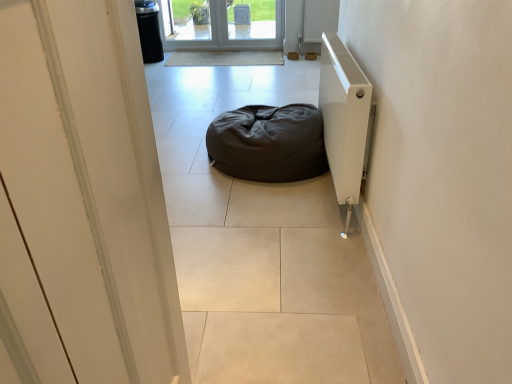
The height and width of the screenshot is (384, 512). In order to click on white textured radiator at right in this screenshot , I will do `click(344, 119)`.

Can you confirm if white glossy door at upper center is shorter than white textured radiator at right?

Incorrect, the height of white glossy door at upper center does not fall short of that of white textured radiator at right.

Is white textured radiator at right inside white glossy door at upper center?

No, white textured radiator at right is not surrounded by white glossy door at upper center.

Between white glossy door at upper center and white textured radiator at right, which one has larger width?

white glossy door at upper center is wider.

From a real-world perspective, is white glossy door at upper center beneath white textured radiator at right?

Incorrect, from a real-world perspective, white glossy door at upper center is higher than white textured radiator at right.

Is white textured radiator at right in front of white glossy door at upper center?

No, white textured radiator at right is further to the viewer.

Is white textured radiator at right wider or thinner than white glossy door at upper center?

white textured radiator at right is thinner than white glossy door at upper center.

Is white textured radiator at right not inside white glossy door at upper center?

white textured radiator at right is positioned outside white glossy door at upper center.

Considering the relative positions of white textured radiator at right and white glossy door at upper center in the image provided, is white textured radiator at right to the left of white glossy door at upper center from the viewer's perspective?

No.

Can you tell me how much white glossy door at upper center and dark fabric bean bag at center differ in facing direction?

white glossy door at upper center and dark fabric bean bag at center are facing 176 degrees away from each other.

Between white glossy door at upper center and dark fabric bean bag at center, which one has less height?

dark fabric bean bag at center.

Considering the positions of points (50, 106) and (247, 153), is point (50, 106) closer to camera compared to point (247, 153)?

Yes.

From a real-world perspective, is white glossy door at upper center above or below dark fabric bean bag at center?

From a real-world perspective, white glossy door at upper center is physically above dark fabric bean bag at center.

From a real-world perspective, is white textured radiator at right physically below dark fabric bean bag at center?

No, from a real-world perspective, white textured radiator at right is not below dark fabric bean bag at center.

Is white textured radiator at right positioned with its back to dark fabric bean bag at center?

Absolutely, white textured radiator at right is directed away from dark fabric bean bag at center.

The width and height of the screenshot is (512, 384). In the image, there is a dark fabric bean bag at center. In order to click on radiator below it (from the image's perspective) in this screenshot , I will do `click(344, 119)`.

Does white textured radiator at right come in front of dark fabric bean bag at center?

Yes, white textured radiator at right is in front of dark fabric bean bag at center.

Relative to white textured radiator at right, is dark fabric bean bag at center in front or behind?

Clearly, dark fabric bean bag at center is behind white textured radiator at right.

Based on their positions, is dark fabric bean bag at center located to the left or right of white textured radiator at right?

In the image, dark fabric bean bag at center appears on the left side of white textured radiator at right.

How much distance is there between dark fabric bean bag at center and white textured radiator at right?

A distance of 39.20 centimeters exists between dark fabric bean bag at center and white textured radiator at right.

Is dark fabric bean bag at center not near white textured radiator at right?

Actually, dark fabric bean bag at center and white textured radiator at right are a little close together.

Is dark fabric bean bag at center bigger or smaller than white glossy door at upper center?

Clearly, dark fabric bean bag at center is larger in size than white glossy door at upper center.

Is dark fabric bean bag at center thinner than white glossy door at upper center?

In fact, dark fabric bean bag at center might be wider than white glossy door at upper center.

Which object is closer to the camera taking this photo, dark fabric bean bag at center or white glossy door at upper center?

white glossy door at upper center is more forward.

The width and height of the screenshot is (512, 384). What are the coordinates of `radiator directly beneath the white glossy door at upper center (from a real-world perspective)` in the screenshot? It's located at (344, 119).

At what (x,y) coordinates should I click in order to perform the action: click on door above the white textured radiator at right (from a real-world perspective). Please return your answer as a coordinate pair (x, y). Looking at the image, I should click on pos(82,201).

Which object lies further to the anchor point dark fabric bean bag at center, white glossy door at upper center or white textured radiator at right?

white glossy door at upper center lies further to dark fabric bean bag at center than the other object.

Based on their spatial positions, is white textured radiator at right or white glossy door at upper center further from dark fabric bean bag at center?

Based on the image, white glossy door at upper center appears to be further to dark fabric bean bag at center.

From the picture: Based on their spatial positions, is dark fabric bean bag at center or white textured radiator at right closer to white glossy door at upper center?

white textured radiator at right lies closer to white glossy door at upper center than the other object.

From the image, which object appears to be nearer to white textured radiator at right, white glossy door at upper center or dark fabric bean bag at center?

dark fabric bean bag at center is closer to white textured radiator at right.

Based on their spatial positions, is dark fabric bean bag at center or white glossy door at upper center further from white textured radiator at right?

The object further to white textured radiator at right is white glossy door at upper center.

From the image, which object appears to be farther from white glossy door at upper center, white textured radiator at right or dark fabric bean bag at center?

dark fabric bean bag at center is positioned further to the anchor white glossy door at upper center.

Locate an element on the screen. radiator between white glossy door at upper center and dark fabric bean bag at center from front to back is located at coordinates (344, 119).